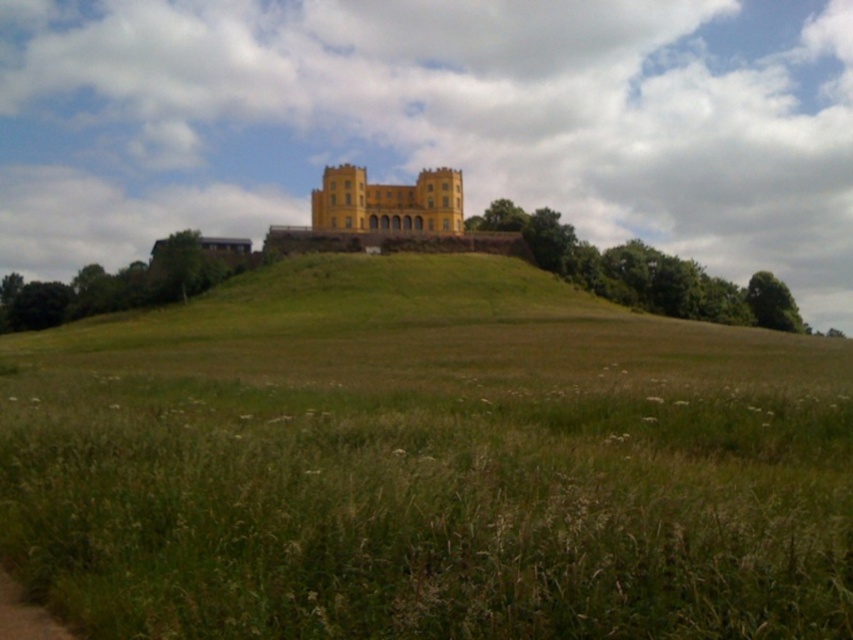
From the picture: Is green grassy hill at upper center smaller than yellow matte building at center?

No, green grassy hill at upper center is not smaller than yellow matte building at center.

Between green grassy hill at upper center and yellow matte building at center, which one appears on the left side from the viewer's perspective?

Positioned to the left is yellow matte building at center.

Measure the distance between green grassy hill at upper center and camera.

green grassy hill at upper center is 48.45 feet away from camera.

Where is `green grassy hill at upper center`? The width and height of the screenshot is (853, 640). green grassy hill at upper center is located at coordinates (426, 465).

Is yellow matte building at center taller than brown dirt path at lower left?

Result: Correct, yellow matte building at center is much taller as brown dirt path at lower left.

Between yellow matte building at center and brown dirt path at lower left, which one has less height?

With less height is brown dirt path at lower left.

Which is in front, point (323, 193) or point (18, 605)?

Positioned in front is point (18, 605).

The width and height of the screenshot is (853, 640). Find the location of `yellow matte building at center`. yellow matte building at center is located at coordinates (387, 202).

The width and height of the screenshot is (853, 640). Describe the element at coordinates (426, 465) in the screenshot. I see `green grassy hill at upper center` at that location.

Between green grassy hill at upper center and brown dirt path at lower left, which one appears on the right side from the viewer's perspective?

Positioned to the right is green grassy hill at upper center.

Describe the element at coordinates (426, 465) in the screenshot. I see `green grassy hill at upper center` at that location.

Image resolution: width=853 pixels, height=640 pixels. What are the coordinates of `green grassy hill at upper center` in the screenshot? It's located at (426, 465).